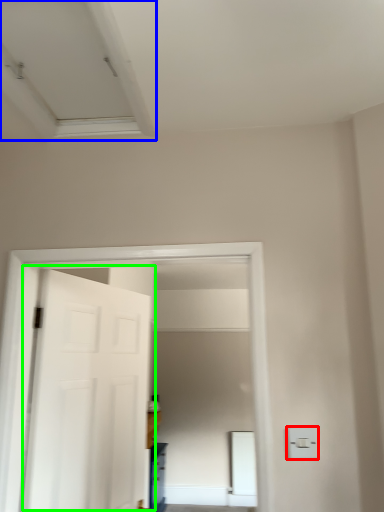
Question: Which object is the closest to the light switch (highlighted by a red box)? Choose among these: exhaust hood (highlighted by a blue box) or door (highlighted by a green box).

Choices:
 (A) exhaust hood
 (B) door

Answer: (B)